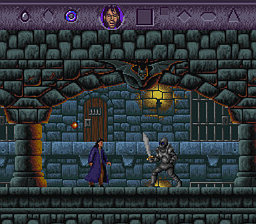
Image resolution: width=256 pixels, height=224 pixels. What are the coordinates of `jail cell` in the screenshot? It's located at (206, 124), (3, 124), (204, 184).